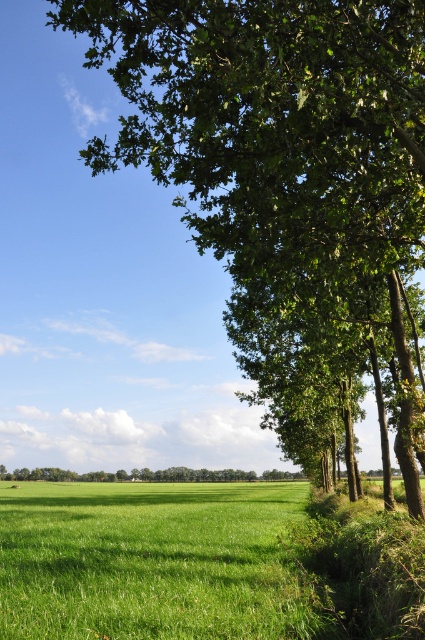
Can you confirm if green leafy tree at upper right is positioned to the right of green grassy field at lower left?

No, green leafy tree at upper right is not to the right of green grassy field at lower left.

Between green leafy tree at upper right and green grassy field at lower left, which one is positioned lower?

green grassy field at lower left is below.

Is point (192, 150) less distant than point (51, 609)?

No, (192, 150) is behind (51, 609).

At what (x,y) coordinates should I click in order to perform the action: click on green leafy tree at upper right. Please return your answer as a coordinate pair (x, y). The height and width of the screenshot is (640, 425). Looking at the image, I should click on (280, 140).

Does green grassy field at lower left lie behind green leafy tree at lower right?

No, it is not.

Between point (251, 528) and point (252, 477), which one is positioned behind?

Point (252, 477)

I want to click on green grassy field at lower left, so pos(152,561).

Where is `green grassy field at lower left`? green grassy field at lower left is located at coordinates (152, 561).

Is green leafy tree at upper right closer to the viewer compared to green leafy tree at lower right?

Yes, it is in front of green leafy tree at lower right.

Looking at this image, does green leafy tree at upper right have a smaller size compared to green leafy tree at lower right?

Actually, green leafy tree at upper right might be larger than green leafy tree at lower right.

Between point (377, 276) and point (149, 472), which one is positioned behind?

The point (149, 472) is behind.

Locate an element on the screen. This screenshot has width=425, height=640. green leafy tree at upper right is located at coordinates (280, 140).